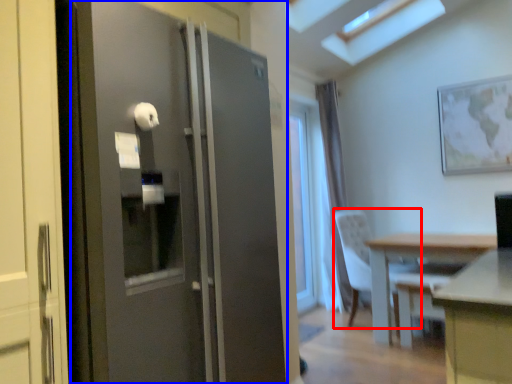
Question: Among these objects, which one is nearest to the camera, chair (highlighted by a red box) or door (highlighted by a blue box)?

Choices:
 (A) chair
 (B) door

Answer: (B)